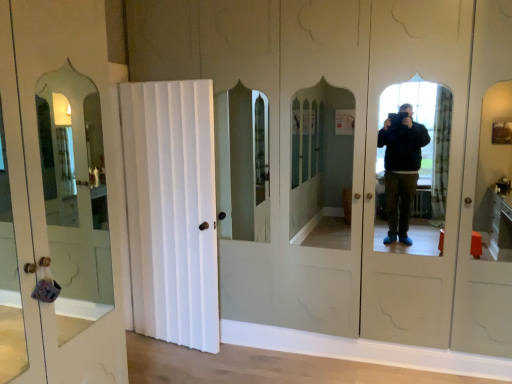
Question: Does white wood door at center, positioned as the 1th door in right-to-left order, lie in front of white wooden door at left, positioned as the 2th door in right-to-left order?

Choices:
 (A) no
 (B) yes

Answer: (A)

Question: Considering the relative positions of white wood door at center, positioned as the 1th door in right-to-left order, and white wooden door at left, positioned as the 2th door in right-to-left order, in the image provided, is white wood door at center, positioned as the 1th door in right-to-left order, to the right of white wooden door at left, positioned as the 2th door in right-to-left order, from the viewer's perspective?

Choices:
 (A) no
 (B) yes

Answer: (B)

Question: Does white wood door at center, which is the second door from left to right, have a smaller size compared to white wooden door at left, positioned as the 2th door in right-to-left order?

Choices:
 (A) yes
 (B) no

Answer: (A)

Question: Is white wood door at center, positioned as the 1th door in right-to-left order, next to white wooden door at left, positioned as the 2th door in right-to-left order, and touching it?

Choices:
 (A) yes
 (B) no

Answer: (B)

Question: From a real-world perspective, is white wood door at center, which is the second door from left to right, physically below white wooden door at left, positioned as the 2th door in right-to-left order?

Choices:
 (A) yes
 (B) no

Answer: (A)

Question: Is white wood door at center, positioned as the 1th door in right-to-left order, not near white wooden door at left, positioned as the 2th door in right-to-left order?

Choices:
 (A) no
 (B) yes

Answer: (B)

Question: Is white wooden door at left, positioned as the 2th door in right-to-left order, in contact with white wood door at center, positioned as the 1th door in right-to-left order?

Choices:
 (A) no
 (B) yes

Answer: (A)

Question: Can you confirm if white wooden door at left, positioned as the 2th door in right-to-left order, is shorter than white wood door at center, which is the second door from left to right?

Choices:
 (A) yes
 (B) no

Answer: (B)

Question: Is white wooden door at left, positioned as the 2th door in right-to-left order, closer to camera compared to white wood door at center, which is the second door from left to right?

Choices:
 (A) no
 (B) yes

Answer: (B)

Question: From a real-world perspective, is white wooden door at left, positioned as the 2th door in right-to-left order, positioned under white wood door at center, which is the second door from left to right, based on gravity?

Choices:
 (A) yes
 (B) no

Answer: (B)

Question: From a real-world perspective, is white wooden door at left, positioned as the 2th door in right-to-left order, on top of white wood door at center, which is the second door from left to right?

Choices:
 (A) yes
 (B) no

Answer: (A)

Question: Considering the relative positions of white wooden door at left, the 1th door from the left, and white wood door at center, positioned as the 1th door in right-to-left order, in the image provided, is white wooden door at left, the 1th door from the left, behind white wood door at center, positioned as the 1th door in right-to-left order,?

Choices:
 (A) yes
 (B) no

Answer: (B)

Question: Considering the relative positions of white wooden door at left, positioned as the 2th door in right-to-left order, and white wood door at center, which is the second door from left to right, in the image provided, is white wooden door at left, positioned as the 2th door in right-to-left order, to the left or to the right of white wood door at center, which is the second door from left to right,?

Choices:
 (A) right
 (B) left

Answer: (B)